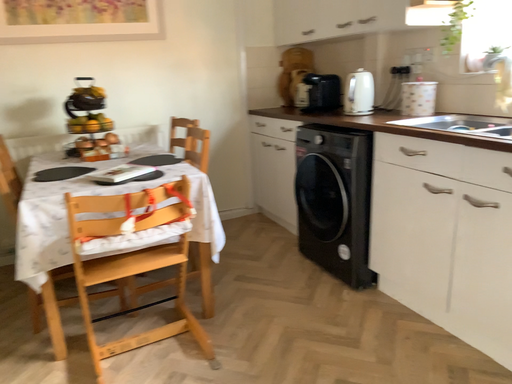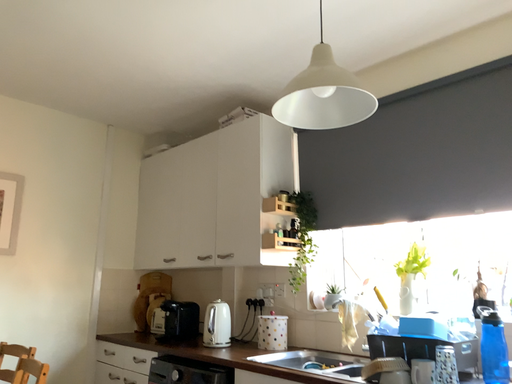
Question: How did the camera likely rotate when shooting the video?

Choices:
 (A) rotated right
 (B) rotated left

Answer: (A)